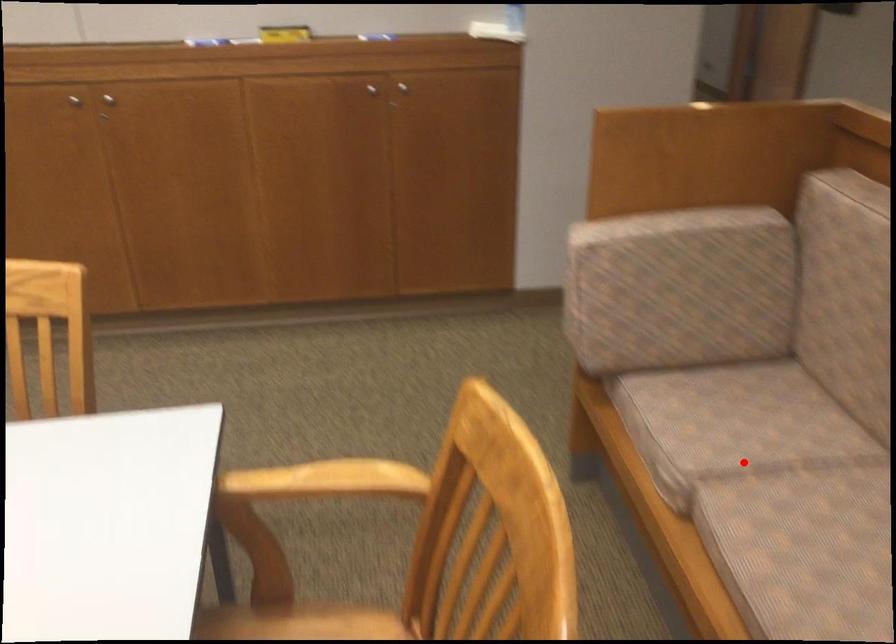
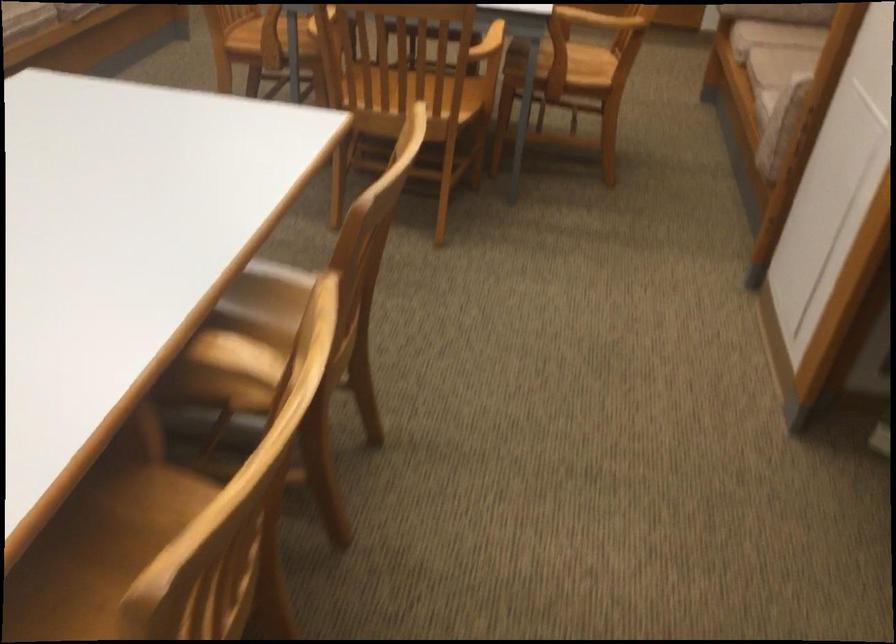
The point at the highlighted location is marked in the first image. Where is the corresponding point in the second image?

(782, 33)